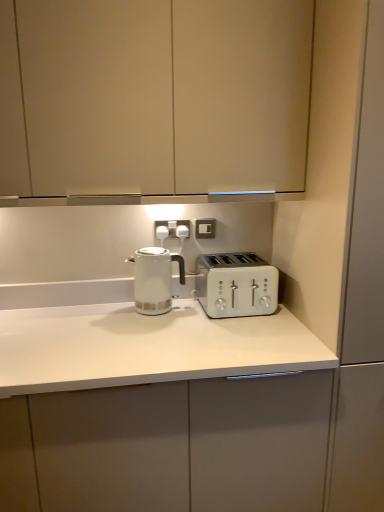
Question: From the image's perspective, is white plastic electric outlet at center, which is the 1th electric outlet from right to left, over matte white cabinet at upper center, which is the 1th cabinetry in top-to-bottom order?

Choices:
 (A) no
 (B) yes

Answer: (A)

Question: Is white plastic electric outlet at center, positioned as the second electric outlet in left-to-right order, facing towards matte white cabinet at upper center, which is the 1th cabinetry in top-to-bottom order?

Choices:
 (A) no
 (B) yes

Answer: (A)

Question: Can you confirm if white plastic electric outlet at center, which is the 1th electric outlet from right to left, is shorter than matte white cabinet at upper center, which is the 1th cabinetry in top-to-bottom order?

Choices:
 (A) yes
 (B) no

Answer: (A)

Question: Considering the relative sizes of white plastic electric outlet at center, which is the 1th electric outlet from right to left, and matte white cabinet at upper center, which is the 1th cabinetry in top-to-bottom order, in the image provided, is white plastic electric outlet at center, which is the 1th electric outlet from right to left, thinner than matte white cabinet at upper center, which is the 1th cabinetry in top-to-bottom order,?

Choices:
 (A) no
 (B) yes

Answer: (B)

Question: Is white plastic electric outlet at center, positioned as the second electric outlet in left-to-right order, oriented away from matte white cabinet at upper center, which is the 1th cabinetry in top-to-bottom order?

Choices:
 (A) yes
 (B) no

Answer: (B)

Question: From a real-world perspective, is white plastic electric outlet at center, positioned as the second electric outlet in left-to-right order, physically above matte white cabinet at upper center, the 2th cabinetry positioned from the bottom?

Choices:
 (A) no
 (B) yes

Answer: (A)

Question: From the image's perspective, is white plastic electrical outlet at center, acting as the 2th electric outlet starting from the right, under white glossy countertop at center, which appears as the second cabinetry when viewed from the top?

Choices:
 (A) no
 (B) yes

Answer: (A)

Question: Is white plastic electrical outlet at center, which is the 1th electric outlet in left-to-right order, wider than white glossy countertop at center, which appears as the second cabinetry when viewed from the top?

Choices:
 (A) yes
 (B) no

Answer: (B)

Question: Is white plastic electrical outlet at center, acting as the 2th electric outlet starting from the right, aimed at white glossy countertop at center, which appears as the second cabinetry when viewed from the top?

Choices:
 (A) yes
 (B) no

Answer: (B)

Question: Is white plastic electrical outlet at center, which is the 1th electric outlet in left-to-right order, smaller than white glossy countertop at center, which appears as the second cabinetry when viewed from the top?

Choices:
 (A) yes
 (B) no

Answer: (A)

Question: Is white glossy countertop at center, which appears as the second cabinetry when viewed from the top, at the back of white plastic electrical outlet at center, acting as the 2th electric outlet starting from the right?

Choices:
 (A) yes
 (B) no

Answer: (B)

Question: Would you say white plastic electrical outlet at center, acting as the 2th electric outlet starting from the right, contains white glossy countertop at center, which is the first cabinetry in bottom-to-top order?

Choices:
 (A) no
 (B) yes

Answer: (A)

Question: Considering the relative sizes of matte white cabinet at upper center, which is the 1th cabinetry in top-to-bottom order, and white plastic electrical outlet at center, which is the 1th electric outlet in left-to-right order, in the image provided, is matte white cabinet at upper center, which is the 1th cabinetry in top-to-bottom order, wider than white plastic electrical outlet at center, which is the 1th electric outlet in left-to-right order,?

Choices:
 (A) no
 (B) yes

Answer: (B)